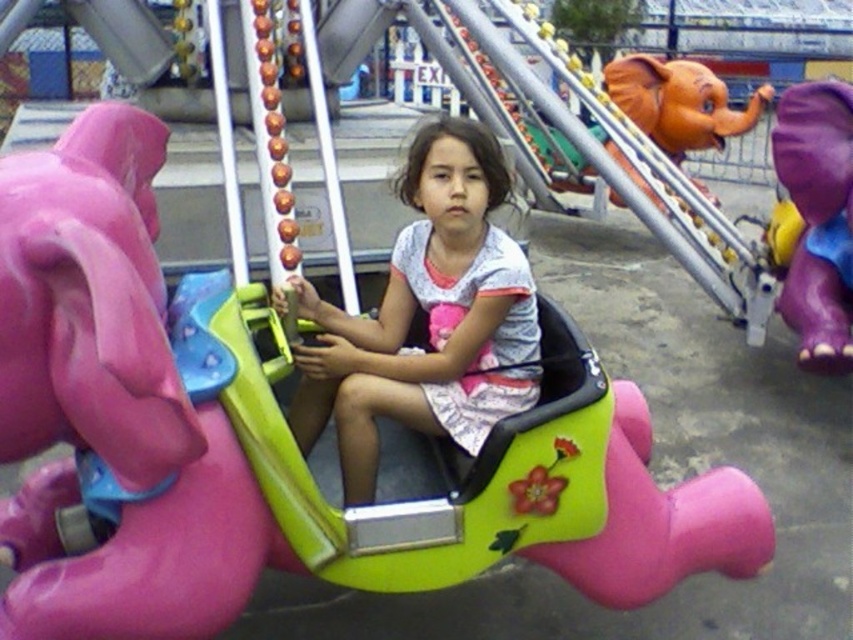
Between matte plastic child at center and purple matte elephant at right, which one is positioned lower?

Positioned lower is matte plastic child at center.

Between matte plastic child at center and purple matte elephant at right, which one is positioned higher?

purple matte elephant at right is higher up.

Is point (387, 396) closer to camera compared to point (817, 138)?

Yes, point (387, 396) is closer to viewer.

This screenshot has height=640, width=853. In order to click on matte plastic child at center in this screenshot , I will do `click(427, 317)`.

Which of these two, purple matte elephant at right or orange matte elephant head at upper right, stands taller?

With more height is purple matte elephant at right.

This screenshot has width=853, height=640. Describe the element at coordinates (817, 220) in the screenshot. I see `purple matte elephant at right` at that location.

Measure the distance between purple matte elephant at right and camera.

3.80 meters

At what (x,y) coordinates should I click in order to perform the action: click on purple matte elephant at right. Please return your answer as a coordinate pair (x, y). Looking at the image, I should click on (817, 220).

Who is higher up, matte plastic child at center or orange matte elephant head at upper right?

Positioned higher is orange matte elephant head at upper right.

Describe the element at coordinates (427, 317) in the screenshot. I see `matte plastic child at center` at that location.

Is point (438, 134) positioned in front of point (714, 202)?

Yes, it is.

Where is `matte plastic child at center`? This screenshot has height=640, width=853. matte plastic child at center is located at coordinates (427, 317).